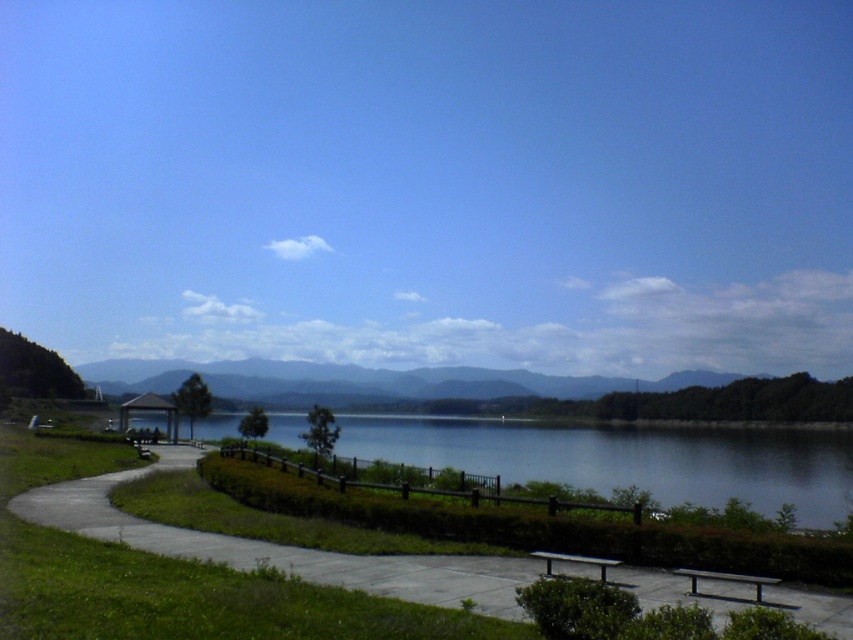
You are standing at the entrance of the pavilion on the left side of the image. You want to walk directly towards the blue glassy water at center. Which direction should you move in relation to the path that curves along the lake edge?

The blue glassy water at center is located at point (627, 460), so you should move towards the center of the image, which is away from the curved path and towards the lake. Since the path curves along the lake edge, you would need to leave the path and head straight towards the center to reach the water directly.

You are a photographer standing at the lower right corner of the image. You want to take a photo that includes both the wooden bench at lower right and the blue glassy water at center. Since you can only focus on one object clearly, which object should you focus on to ensure the other is still somewhat in focus?

You should focus on the wooden bench at lower right because it is closer to you than the blue glassy water at center. By focusing on the closer object, the background object will still be somewhat in focus.

Consider the image. You are a maintenance worker who needs to place a new wooden park bench at lower center on the concrete at center. Can the bench fit on the concrete?

The concrete at center is wider than the wooden park bench at lower center, so the bench can fit on the concrete.